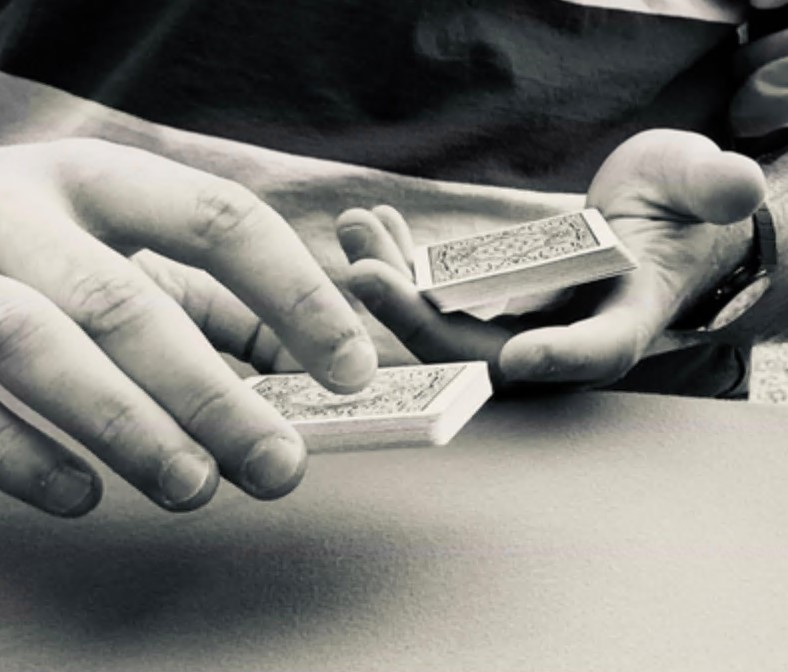
The height and width of the screenshot is (672, 788). Identify the location of tabletop. (534, 528).